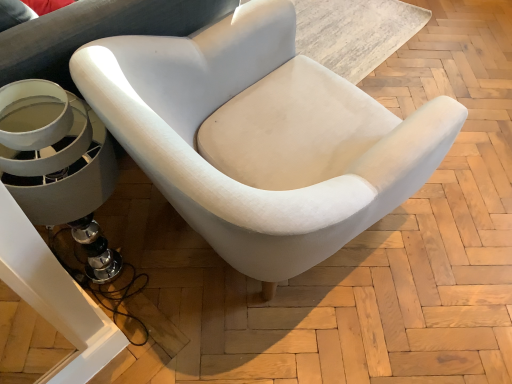
I want to click on vacant area located to the right-hand side of white fabric chair at center, so click(x=441, y=246).